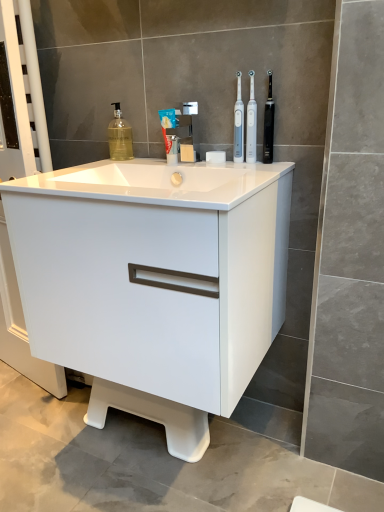
I want to click on vacant space in front of white plastic toothbrush at upper center, acting as the 2th toothbrush starting from the right, so click(266, 168).